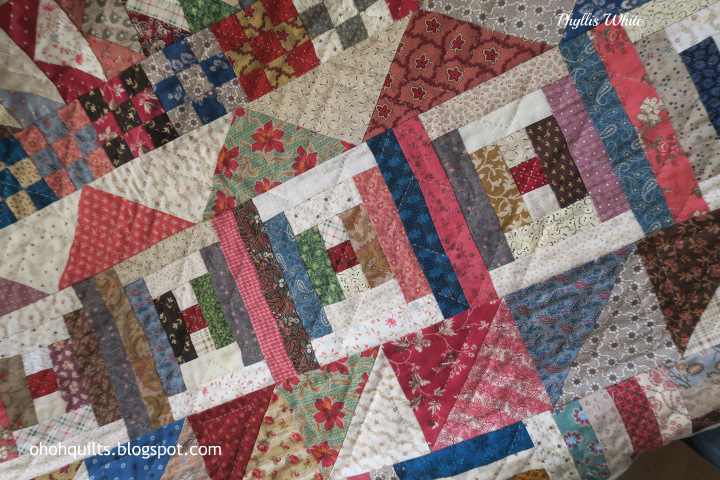
You are a GUI agent. You are given a task and a screenshot of the screen. Output one action in this format:
    pyautogui.click(x=<x>, y=<y>)
    Task: Click on the quilt
    
    Given the screenshot: What is the action you would take?
    pyautogui.click(x=302, y=119)